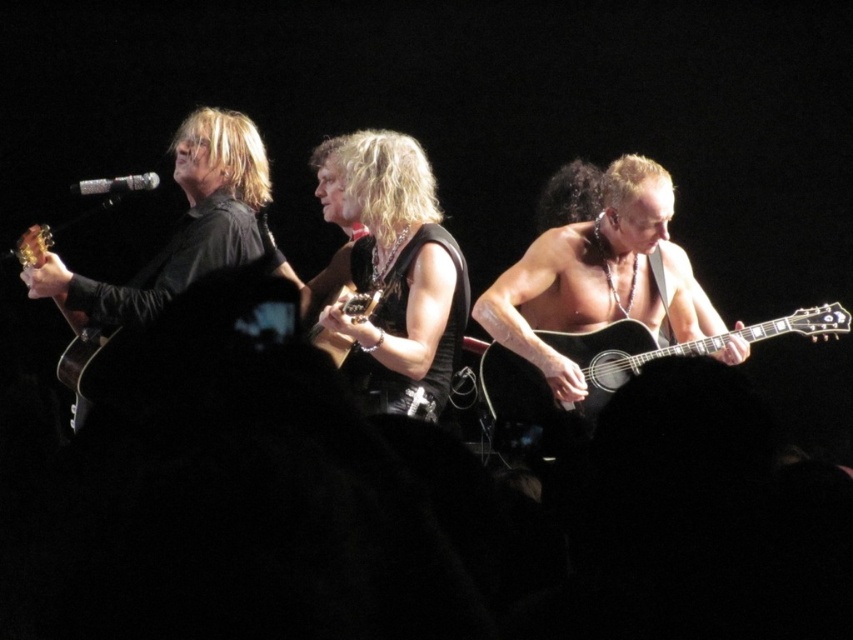
You are a photographer at the back of the venue. You want to take a photo of the silver metallic microphone at upper center but need to ensure the matte black guitar at left won

The matte black guitar at left is to the left of the silver metallic microphone at upper center, so positioning yourself to the right side of the stage would allow you to capture the microphone without the guitar obstructing the view.

You are a stagehand responsible for adjusting the lighting. You need to position a spotlight to highlight the acoustic wood guitar at right. According to the coordinates provided, where should you aim the spotlight?

The acoustic wood guitar at right is located at coordinates point (602, 374), so the spotlight should be aimed at that specific point to highlight it.

You are a stagehand adjusting the lighting for the performance. You need to ensure that the matte black guitar at center is illuminated properly. Since it is positioned under the silver metallic microphone at upper center, will the microphone block the light from reaching the guitar?

The matte black guitar at center is positioned under the silver metallic microphone at upper center, so the microphone may block some light from reaching the guitar. Adjust the lighting angles to avoid obstruction.